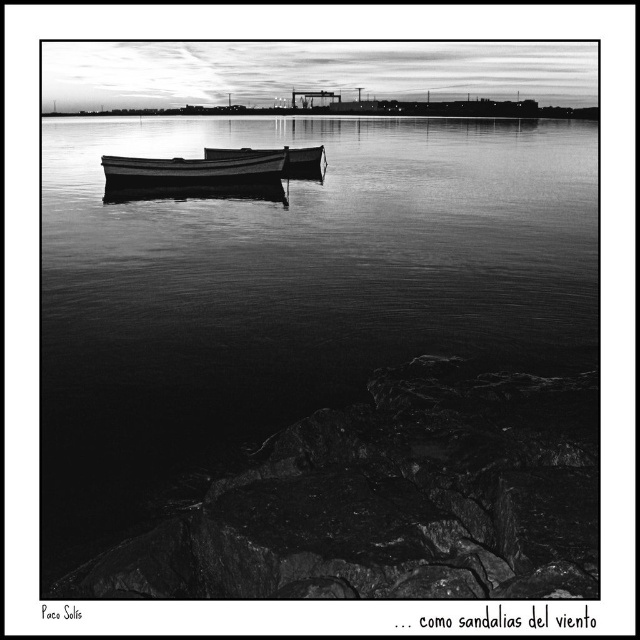
Question: Is the position of smooth water at center more distant than that of smooth wood canoe at center?

Choices:
 (A) no
 (B) yes

Answer: (A)

Question: From the image, what is the correct spatial relationship of smooth wood canoe at center in relation to wooden canoe at center?

Choices:
 (A) below
 (B) above

Answer: (A)

Question: Which of the following is the farthest from the observer?

Choices:
 (A) (289, 170)
 (B) (225, 182)

Answer: (A)

Question: Which point appears farthest from the camera in this image?

Choices:
 (A) 124,358
 (B) 266,150

Answer: (B)

Question: Which object appears farthest from the camera in this image?

Choices:
 (A) wooden canoe at center
 (B) smooth water at center

Answer: (A)

Question: Does smooth wood canoe at center appear on the right side of wooden canoe at center?

Choices:
 (A) yes
 (B) no

Answer: (B)